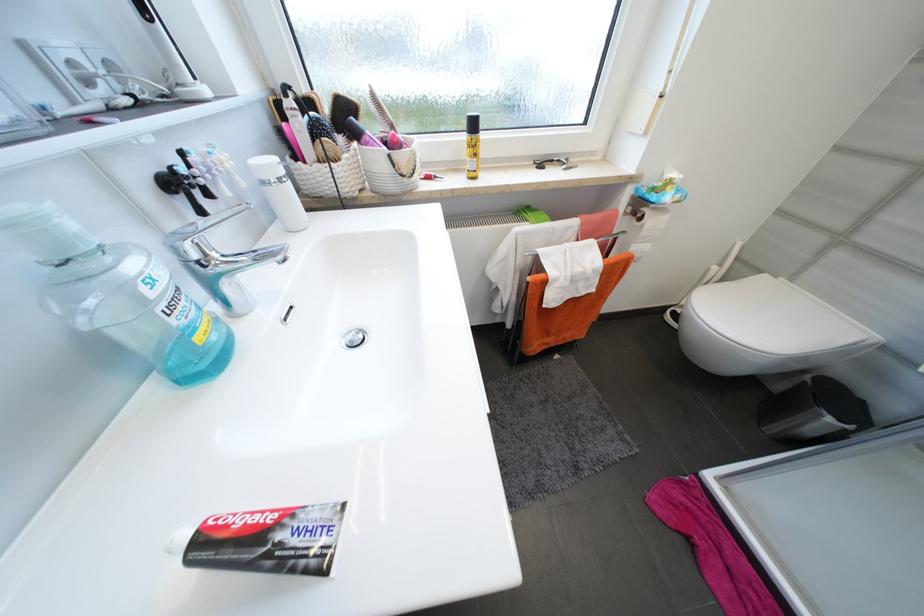
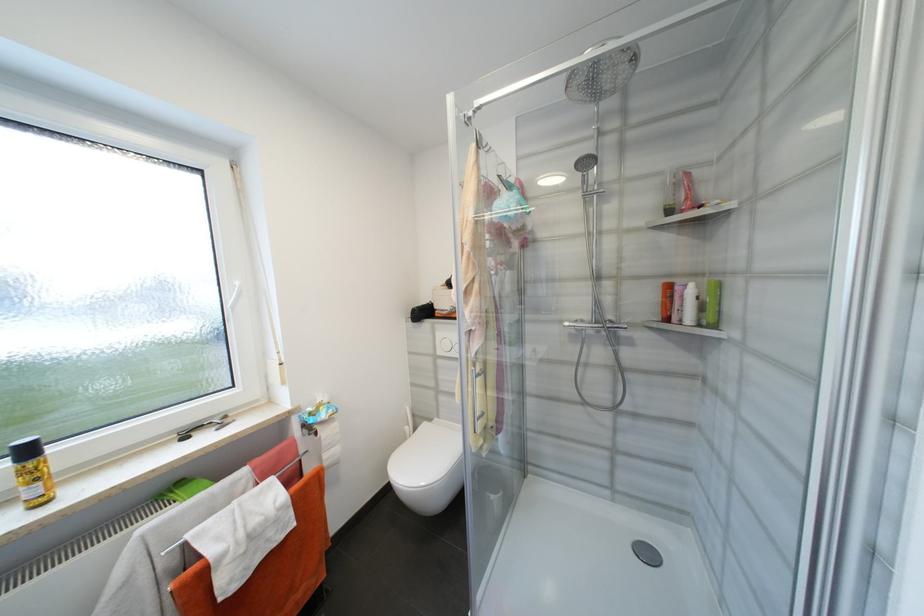
Find the pixel in the second image that matches [647,219] in the first image.

(322, 435)